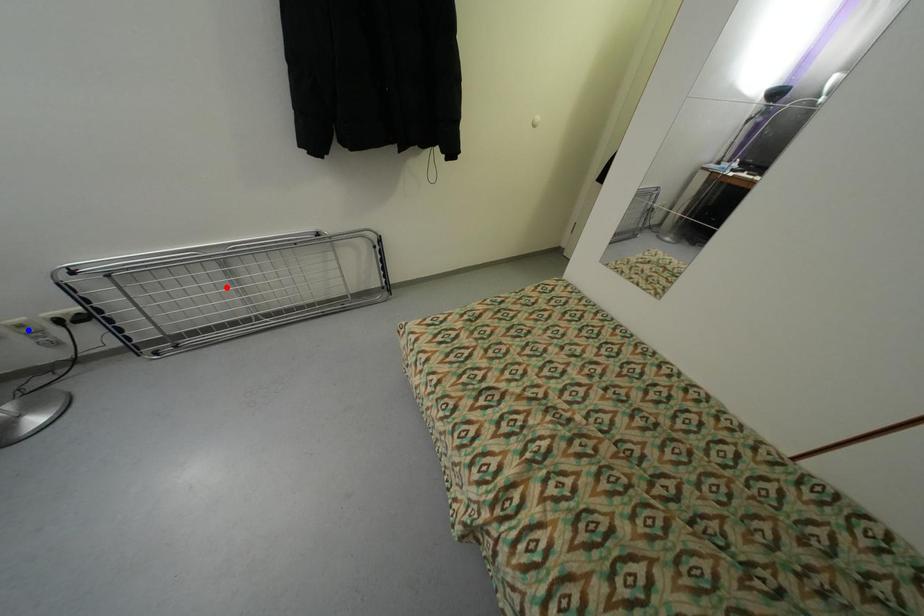
Question: Which of the two points in the image is closer to the camera?

Choices:
 (A) Blue point is closer.
 (B) Red point is closer.

Answer: (A)